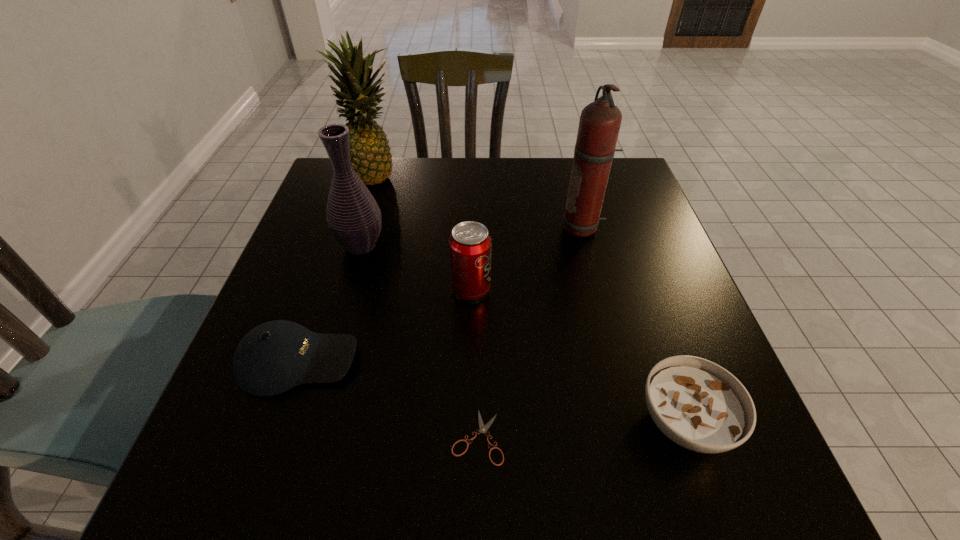
Find the location of `pineapple that is positioned at the left edge`. pineapple that is positioned at the left edge is located at coordinates (371, 159).

Find the location of a particular element. vase at the left edge is located at coordinates (353, 216).

Where is `baseball cap that is at the left edge`? Image resolution: width=960 pixels, height=540 pixels. baseball cap that is at the left edge is located at coordinates (272, 358).

This screenshot has width=960, height=540. I want to click on fire extinguisher that is at the right edge, so click(600, 121).

The width and height of the screenshot is (960, 540). In order to click on soup bowl that is at the right edge in this screenshot , I will do 699,405.

Identify the location of object positioned at the far left corner. This screenshot has width=960, height=540. (371, 159).

Find the location of a particular element. This screenshot has width=960, height=540. object at the near right corner is located at coordinates (699, 405).

Locate an element on the screen. The width and height of the screenshot is (960, 540). free region at the far edge of the desktop is located at coordinates (398, 201).

Where is `vacant space at the near edge of the desktop`? The image size is (960, 540). vacant space at the near edge of the desktop is located at coordinates (654, 482).

At what (x,y) coordinates should I click in order to perform the action: click on vacant space at the left edge of the desktop. Please return your answer as a coordinate pair (x, y). This screenshot has width=960, height=540. Looking at the image, I should click on (346, 295).